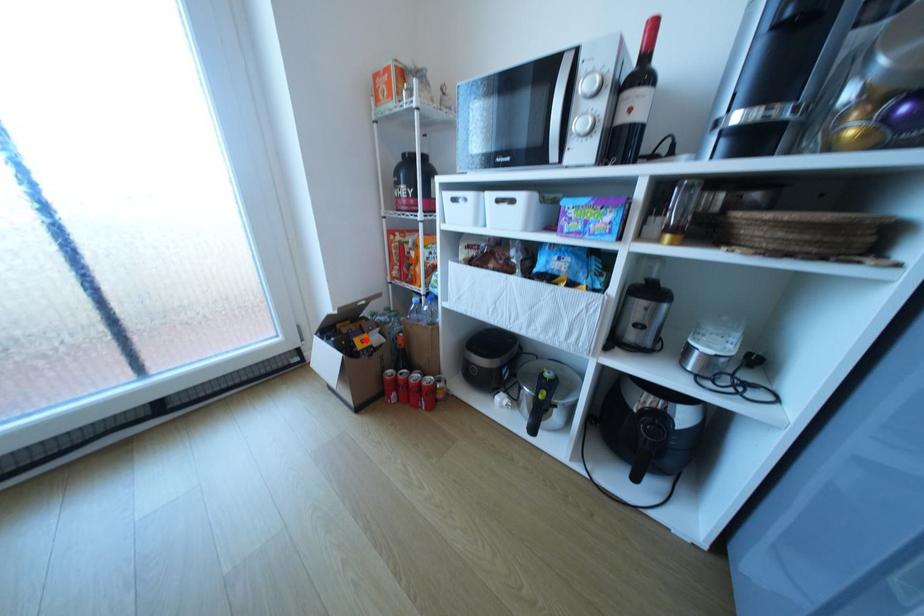
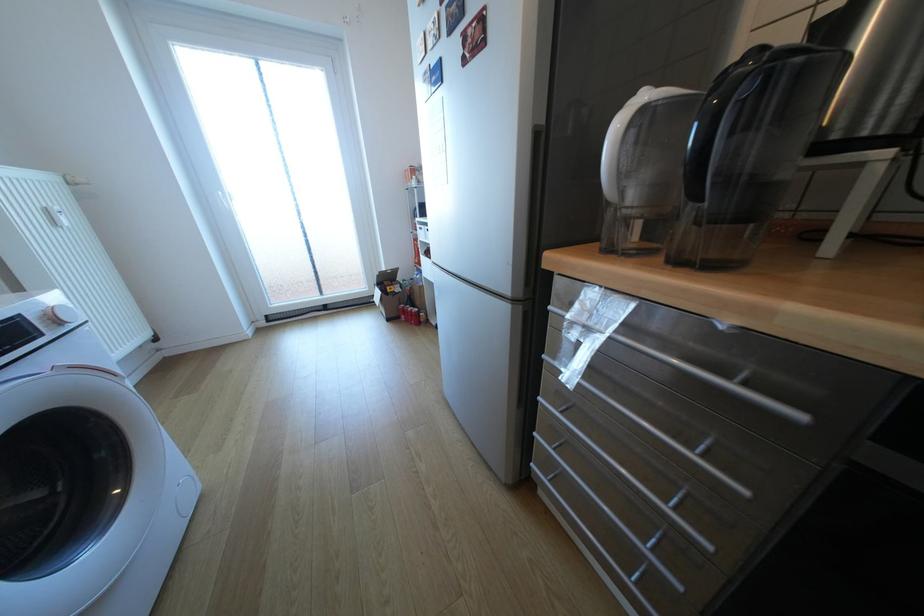
Question: A red point is marked in image1. In image2, is the corresponding 3D point closer to the camera or farther? Reply with the corresponding letter.

Choices:
 (A) The corresponding 3D point is closer.
 (B) The corresponding 3D point is farther.

Answer: (A)